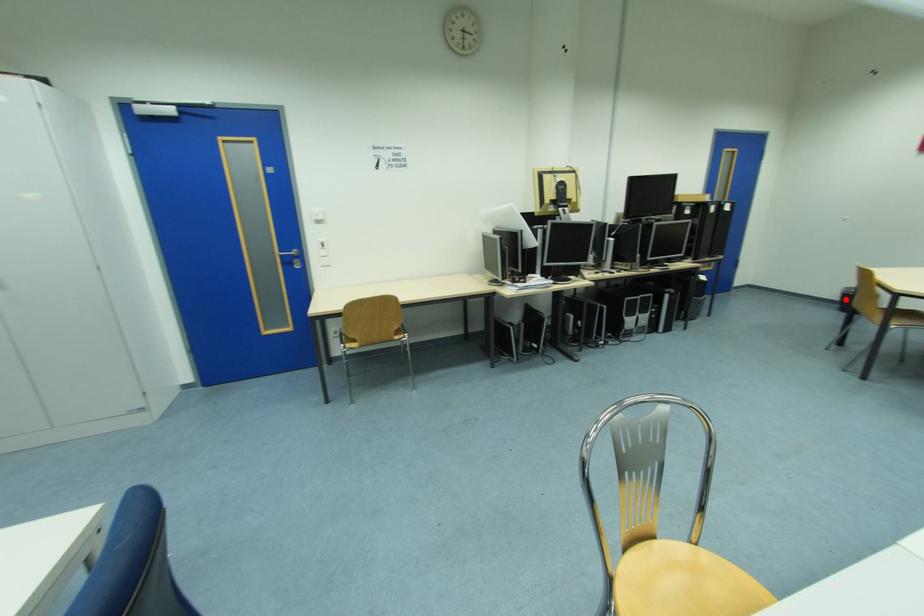
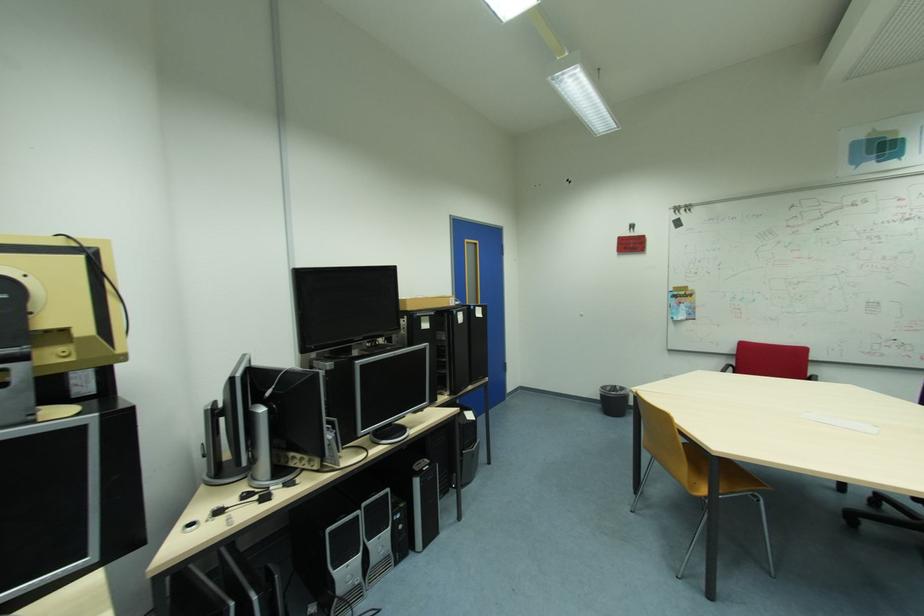
Where in the second image is the point corresponding to the highlighted location from the first image?

(605, 400)